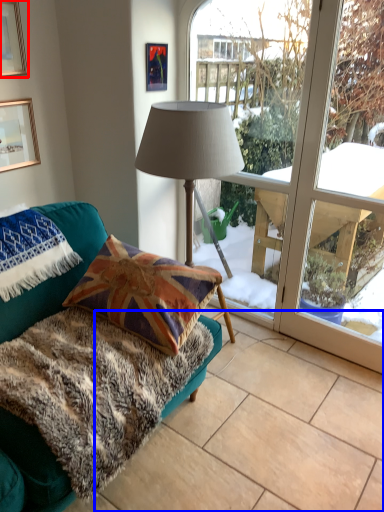
Question: Which object appears farthest to the camera in this image, picture frame (highlighted by a red box) or tile (highlighted by a blue box)?

Choices:
 (A) picture frame
 (B) tile

Answer: (A)